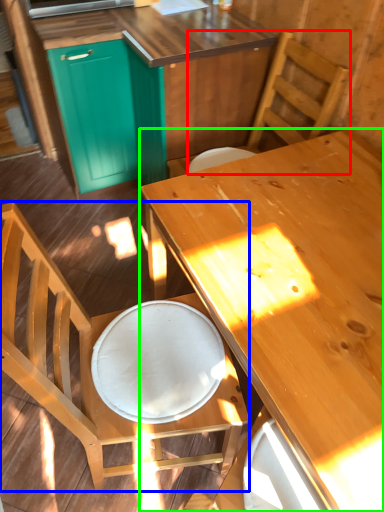
Question: Considering the real-world distances, which object is farthest from chair (highlighted by a red box)? chair (highlighted by a blue box) or desk (highlighted by a green box)?

Choices:
 (A) chair
 (B) desk

Answer: (A)